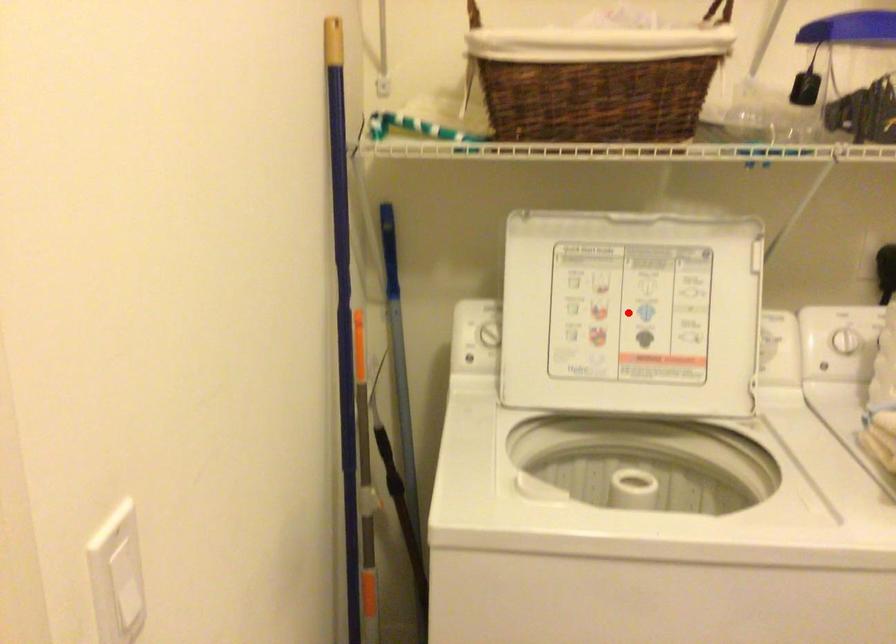
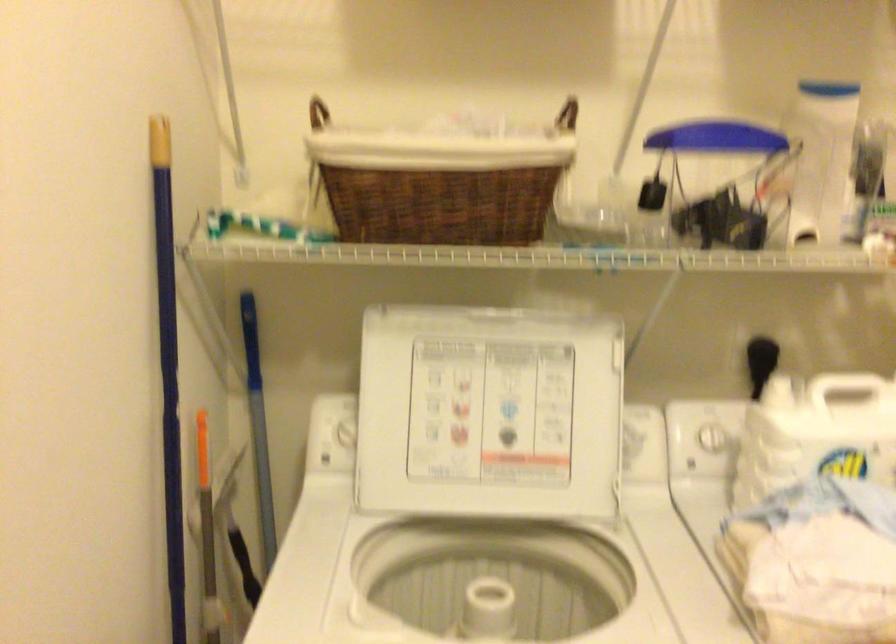
Locate, in the second image, the point that corresponds to the highlighted location in the first image.

(488, 413)